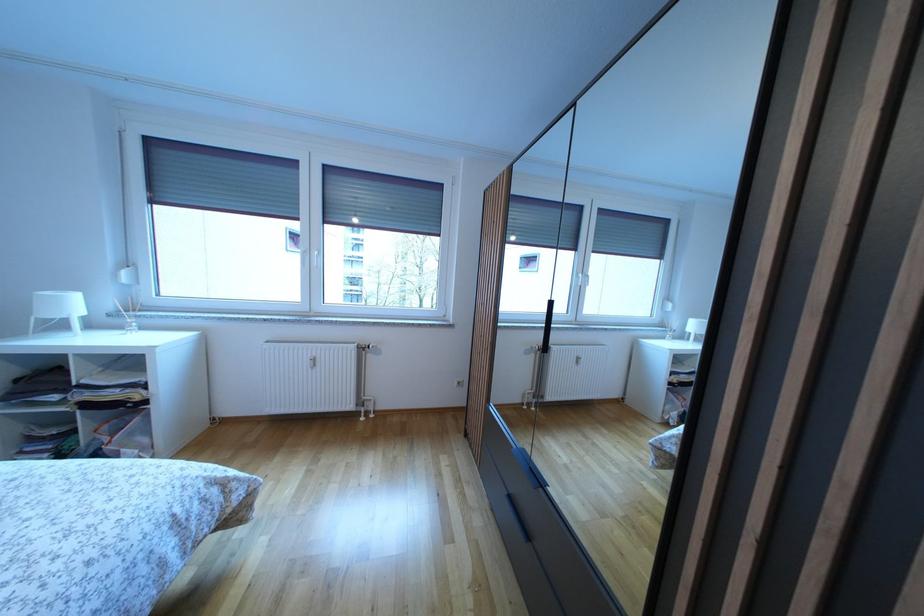
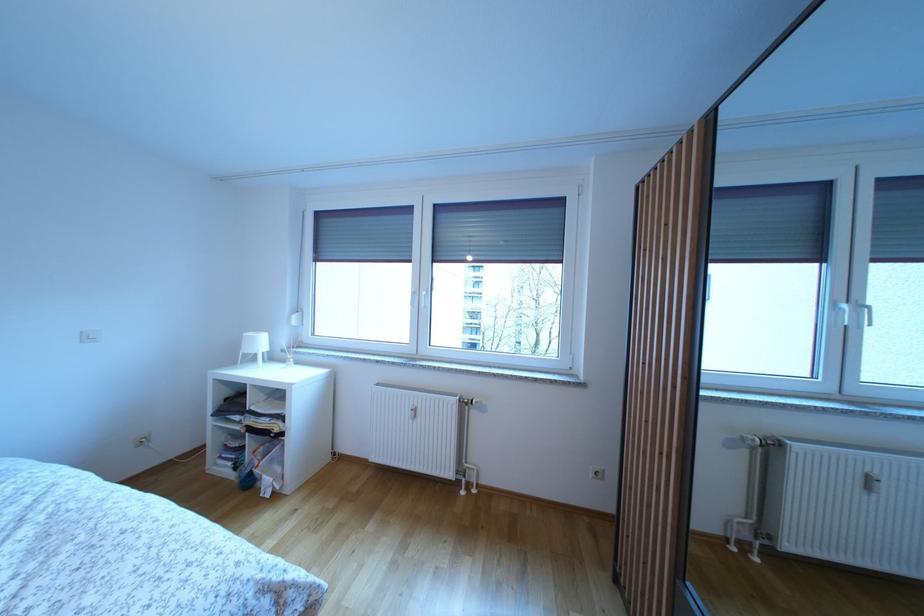
Question: The camera is either moving clockwise (left) or counter-clockwise (right) around the object. The first image is from the beginning of the video and the second image is from the end. Is the camera moving left or right when shooting the video?

Choices:
 (A) Left
 (B) Right

Answer: (B)